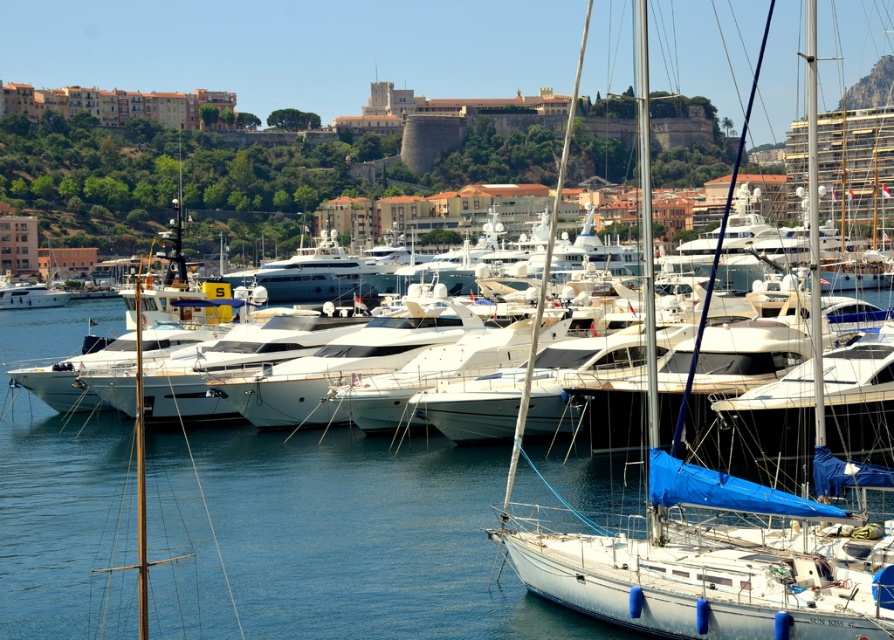
You are a photographer planning to capture the marina scene. You want to ensure that both the clear blue water at center and the white glossy yacht at left are visible in your shot. Which object should you focus on to include both in the frame, considering their sizes?

The clear blue water at center is larger in size than the white glossy yacht at left, so focusing on the larger clear blue water at center will ensure both objects are visible in the frame.

You are standing at the edge of the marina and see two points marked in the image. Which point, point (449,621) or point (751,99), is closer to you?

Point (449,621) is closer to you because it is in front of point (751,99).